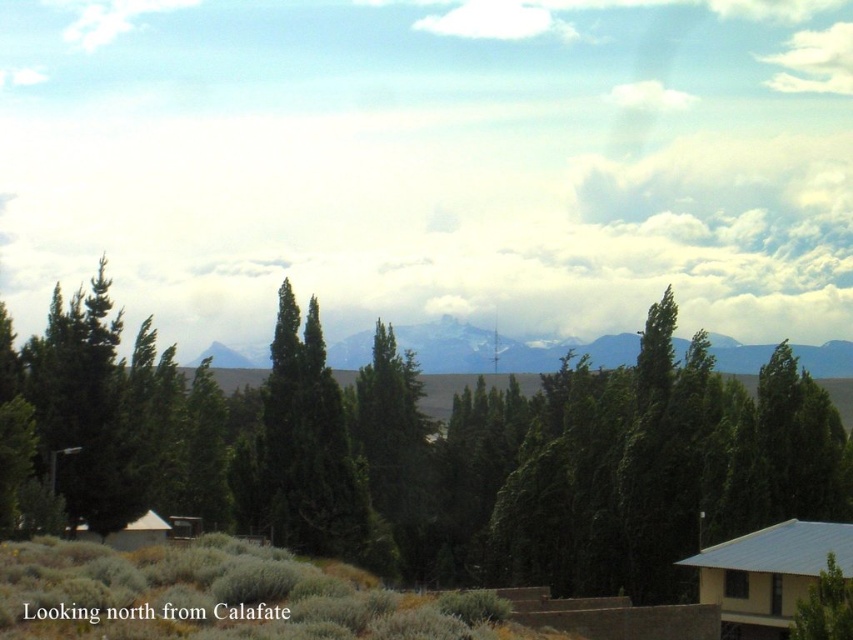
You are standing at the scenic viewpoint looking north from Calafate. You notice two trees in the foreground of the image. The first is the green leafy tree at center, and the second is the green matte tree at left. Which of these two trees is positioned closer to the horizon?

The green leafy tree at center is positioned closer to the horizon because it is located below the green matte tree at left, indicating it is further away from the viewer.

You are standing at the point marked as point (430, 452) in the image. What object is located exactly at that point?

The green leafy tree at center is located exactly at point (430, 452).